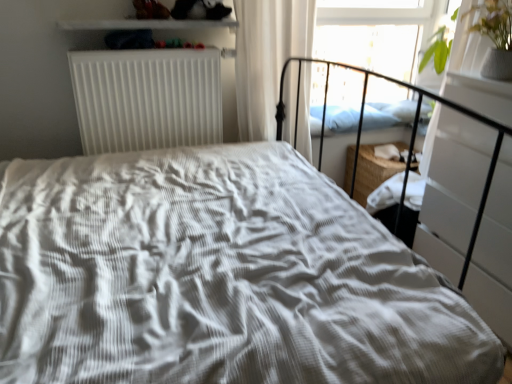
Question: Considering the relative sizes of white sheer curtain at upper right and blue soft pillow at upper right in the image provided, is white sheer curtain at upper right taller than blue soft pillow at upper right?

Choices:
 (A) yes
 (B) no

Answer: (A)

Question: Is white sheer curtain at upper right outside of blue soft pillow at upper right?

Choices:
 (A) yes
 (B) no

Answer: (A)

Question: Can blue soft pillow at upper right be found inside white sheer curtain at upper right?

Choices:
 (A) yes
 (B) no

Answer: (B)

Question: From the image's perspective, would you say white sheer curtain at upper right is shown under blue soft pillow at upper right?

Choices:
 (A) no
 (B) yes

Answer: (A)

Question: Does white sheer curtain at upper right have a greater width compared to blue soft pillow at upper right?

Choices:
 (A) no
 (B) yes

Answer: (A)

Question: From a real-world perspective, is blue soft pillow at upper right physically located above or below white sheer curtain at upper right?

Choices:
 (A) below
 (B) above

Answer: (A)

Question: Looking at the image, does blue soft pillow at upper right seem bigger or smaller compared to white sheer curtain at upper right?

Choices:
 (A) small
 (B) big

Answer: (A)

Question: From the image's perspective, is blue soft pillow at upper right above or below white sheer curtain at upper right?

Choices:
 (A) above
 (B) below

Answer: (B)

Question: Considering the positions of blue soft pillow at upper right and white sheer curtain at upper right in the image, is blue soft pillow at upper right taller or shorter than white sheer curtain at upper right?

Choices:
 (A) short
 (B) tall

Answer: (A)

Question: Considering the relative positions of white matte radiator at upper left and white glossy shelf at upper center in the image provided, is white matte radiator at upper left to the left or to the right of white glossy shelf at upper center?

Choices:
 (A) left
 (B) right

Answer: (A)

Question: Considering the positions of point (216, 62) and point (157, 28), is point (216, 62) closer or farther from the camera than point (157, 28)?

Choices:
 (A) farther
 (B) closer

Answer: (A)

Question: Looking at the image, does white matte radiator at upper left seem bigger or smaller compared to white glossy shelf at upper center?

Choices:
 (A) big
 (B) small

Answer: (A)

Question: Considering their positions, is white matte radiator at upper left located in front of or behind white glossy shelf at upper center?

Choices:
 (A) behind
 (B) front

Answer: (A)

Question: Looking at the image, does transparent glass window screen at upper right seem bigger or smaller compared to white glossy shelf at upper center?

Choices:
 (A) small
 (B) big

Answer: (B)

Question: From a real-world perspective, is transparent glass window screen at upper right physically located above or below white glossy shelf at upper center?

Choices:
 (A) below
 (B) above

Answer: (A)